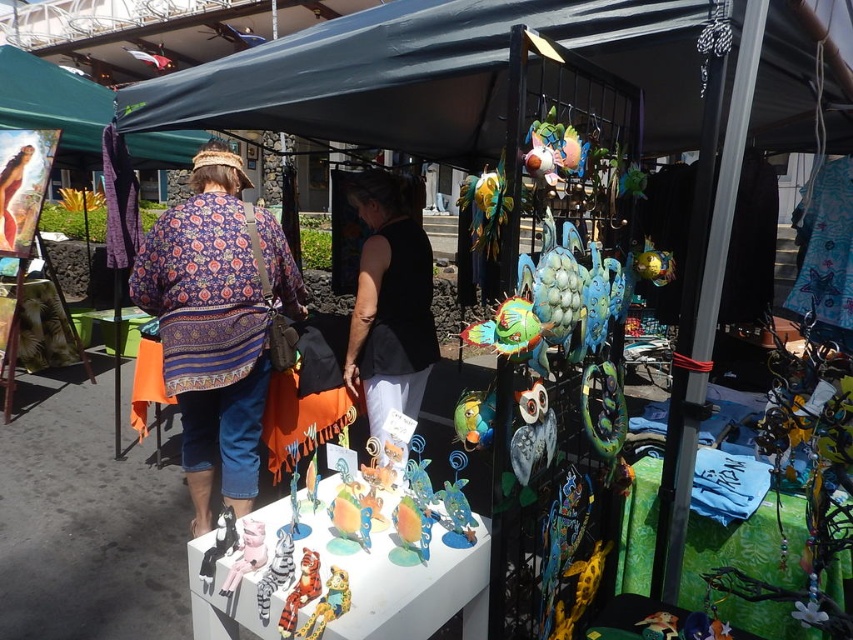
From the picture: You are standing at the entrance of the market tent and want to take a photo of two points marked in the scene. The first point is at coordinates point (x=258, y=413) and the second is at point (x=387, y=220). Which point will appear larger in your photo?

Point (x=258, y=413) is closer to the camera than point (x=387, y=220), so it will appear larger in the photo.

You are a customer at the market and want to buy a shirt. You see the patterned fabric shirt at center and the black matte tank top at center. Which one do you think is larger?

The patterned fabric shirt at center is bigger than the black matte tank top at center.

You are a customer at the market and want to know if the dark green fabric canopy at upper center can provide shade over the black matte tank top at center. Based on their sizes, is this possible?

The dark green fabric canopy at upper center might be wider than black matte tank top at center, so it is possible that the canopy could provide shade over the tank top if positioned correctly.